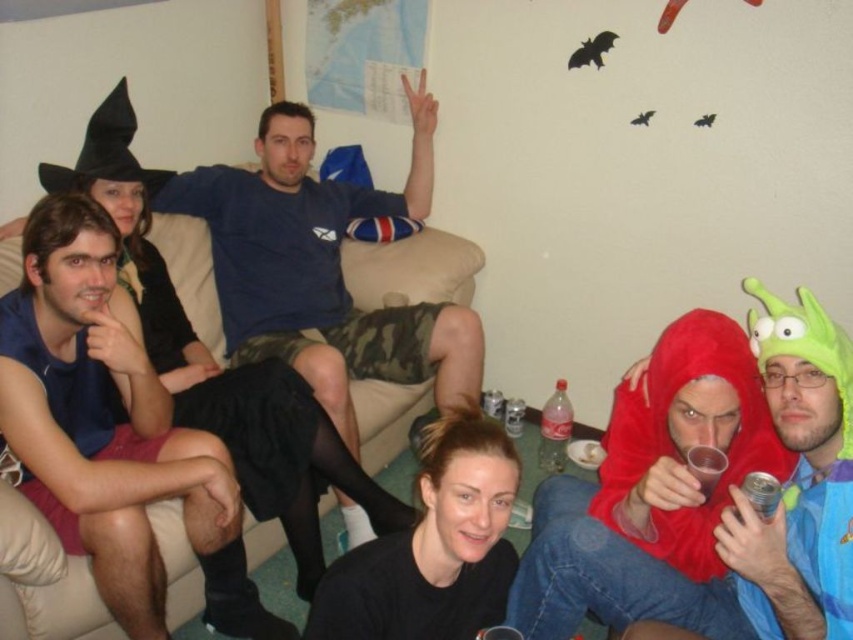
Consider the image. Can you confirm if dark blue sleeveless shirt at left is positioned above blue cotton t-shirt at center?

Actually, dark blue sleeveless shirt at left is below blue cotton t-shirt at center.

How much distance is there between dark blue sleeveless shirt at left and blue cotton t-shirt at center?

They are 29.66 inches apart.

The image size is (853, 640). What do you see at coordinates (115, 435) in the screenshot? I see `dark blue sleeveless shirt at left` at bounding box center [115, 435].

Where is `dark blue sleeveless shirt at left`? The width and height of the screenshot is (853, 640). dark blue sleeveless shirt at left is located at coordinates (115, 435).

Is point (242, 388) farther from viewer compared to point (770, 512)?

Yes, point (242, 388) is behind point (770, 512).

Does point (305, 417) lie in front of point (776, 502)?

No, it is behind (776, 502).

Where is `black fabric skirt at left`? This screenshot has height=640, width=853. black fabric skirt at left is located at coordinates (259, 429).

Where is `black fabric skirt at left`? black fabric skirt at left is located at coordinates (259, 429).

Between black fabric skirt at left and metallic can at lower center, which one has less height?

With less height is metallic can at lower center.

Can you confirm if black fabric skirt at left is positioned to the left of metallic can at lower center?

Yes, black fabric skirt at left is to the left of metallic can at lower center.

Find the location of a particular element. black fabric skirt at left is located at coordinates (259, 429).

What are the coordinates of `black fabric skirt at left` in the screenshot? It's located at (259, 429).